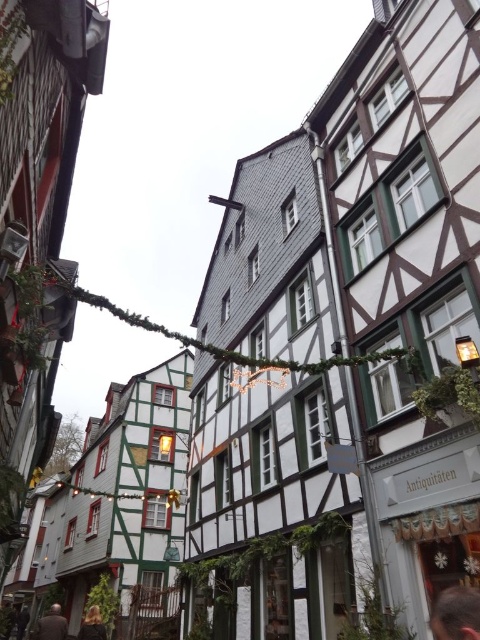
Measure the distance between dark brown hair at lower right and camera.

The distance of dark brown hair at lower right from camera is 3.06 meters.

In the scene shown: Who is lower down, dark brown hair at lower right or blonde hair at lower left?

blonde hair at lower left

Who is more forward, (x=470, y=602) or (x=84, y=621)?

Positioned in front is point (x=470, y=602).

In order to click on dark brown hair at lower right in this screenshot , I will do `click(456, 614)`.

Is point (47, 621) farther from viewer compared to point (2, 604)?

No.

Is dark brown hair at lower left bigger than brown leather jacket at lower left?

Yes, dark brown hair at lower left is bigger than brown leather jacket at lower left.

Based on the photo, who is more distant from viewer, [66,632] or [3,637]?

Positioned behind is point [3,637].

The image size is (480, 640). What are the coordinates of `dark brown hair at lower left` in the screenshot? It's located at (50, 625).

Is dark brown hair at lower right below brown leather jacket at lower left?

No, dark brown hair at lower right is not below brown leather jacket at lower left.

Which is in front, point (436, 627) or point (7, 632)?

Point (436, 627) is in front.

Is point (435, 605) positioned behind point (2, 608)?

That is False.

Where is `dark brown hair at lower right`? dark brown hair at lower right is located at coordinates (456, 614).